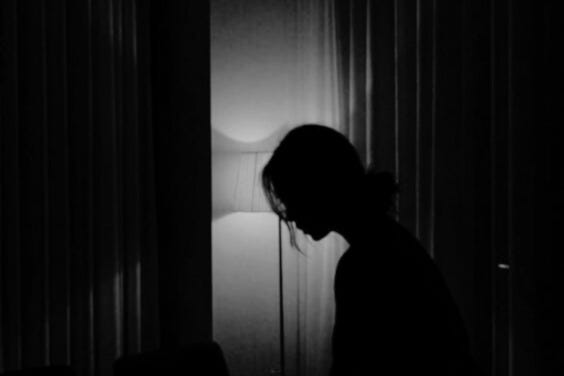
I want to click on black curtains, so click(x=110, y=195).